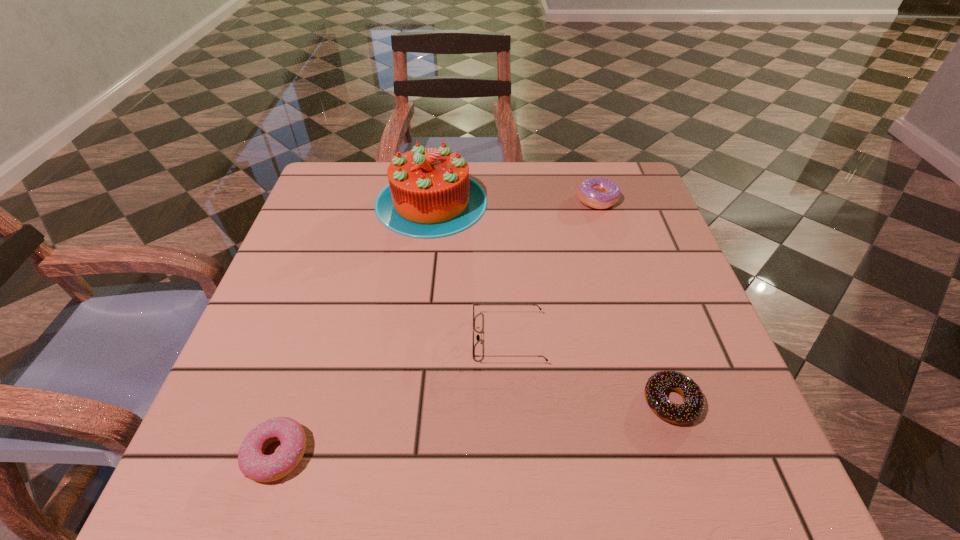
Find the location of a particular element. The height and width of the screenshot is (540, 960). vacant space that is in between the shortest object and the leftmost doughnut is located at coordinates (474, 428).

At what (x,y) coordinates should I click in order to perform the action: click on free space between the leftmost doughnut and the tallest object. Please return your answer as a coordinate pair (x, y). This screenshot has height=540, width=960. Looking at the image, I should click on (354, 328).

This screenshot has width=960, height=540. Identify the location of vacant space that is in between the farthest doughnut and the sunglasses. (553, 269).

Select which object appears as the closest to the farthest doughnut. Please provide its 2D coordinates. Your answer should be formatted as a tuple, i.e. [(x, y)], where the tuple contains the x and y coordinates of a point satisfying the conditions above.

[(430, 195)]

Locate an element on the screen. Image resolution: width=960 pixels, height=540 pixels. object that ranks as the second closest to the third nearest object is located at coordinates (430, 195).

Identify the location of the closest doughnut relative to the third farthest object. The image size is (960, 540). (691, 409).

Select which doughnut appears as the closest to the leftmost doughnut. Please provide its 2D coordinates. Your answer should be formatted as a tuple, i.e. [(x, y)], where the tuple contains the x and y coordinates of a point satisfying the conditions above.

[(691, 409)]

Locate an element on the screen. Image resolution: width=960 pixels, height=540 pixels. free location that satisfies the following two spatial constraints: 1. on the front side of the farthest doughnut; 2. on the right side of the shortest object is located at coordinates (660, 402).

Where is `free spot that satisfies the following two spatial constraints: 1. on the front side of the farthest doughnut; 2. on the front-facing side of the third nearest object`? Image resolution: width=960 pixels, height=540 pixels. free spot that satisfies the following two spatial constraints: 1. on the front side of the farthest doughnut; 2. on the front-facing side of the third nearest object is located at coordinates (640, 339).